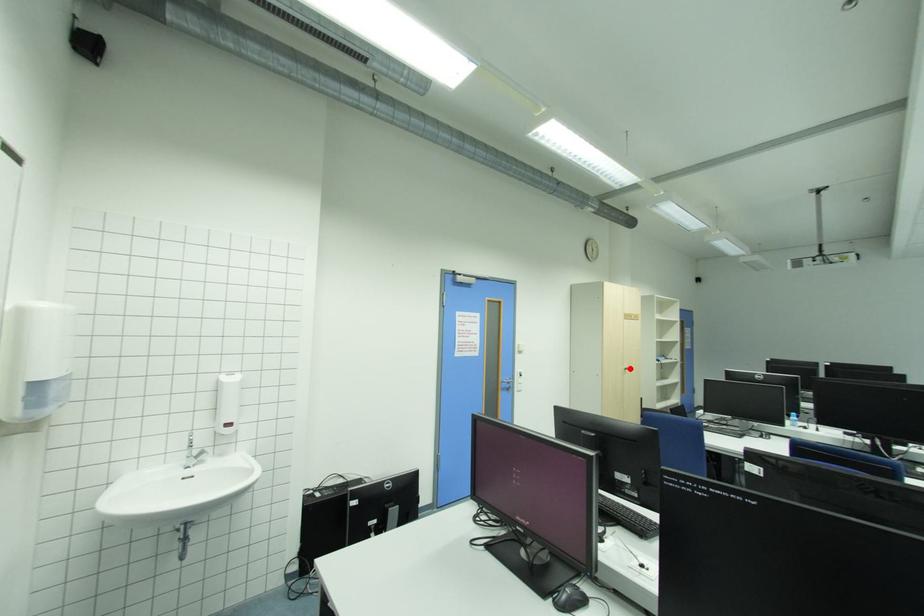
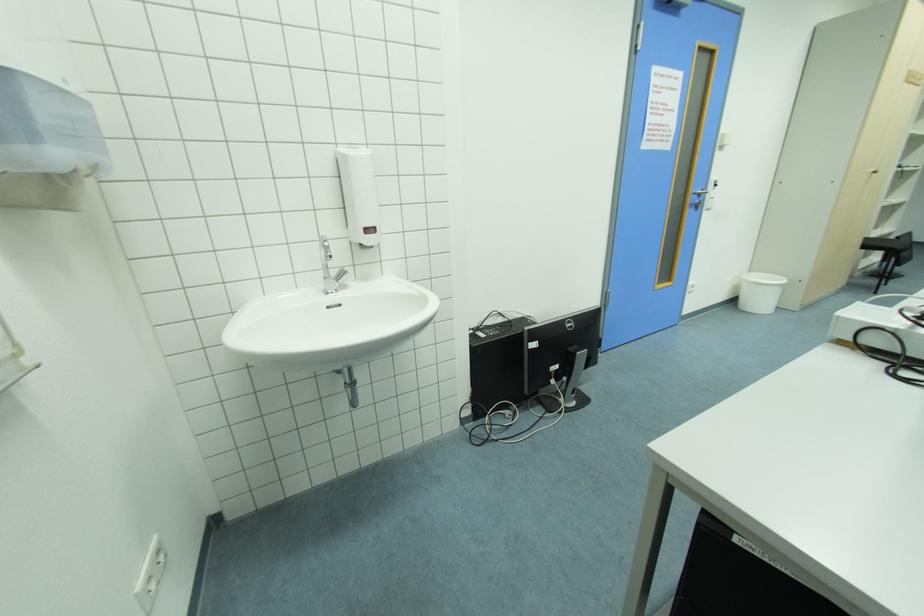
In the second image, find the point that corresponds to the highlighted location in the first image.

(878, 172)